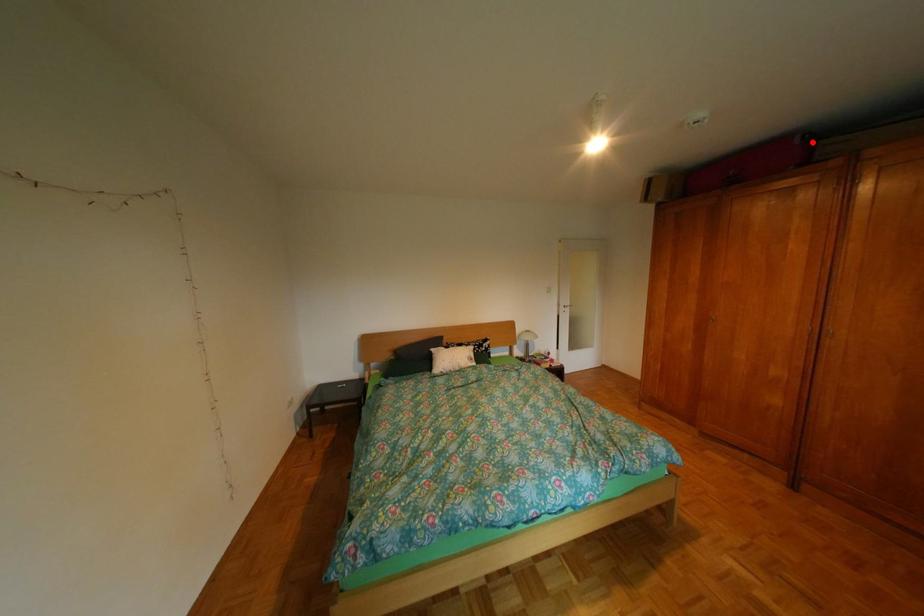
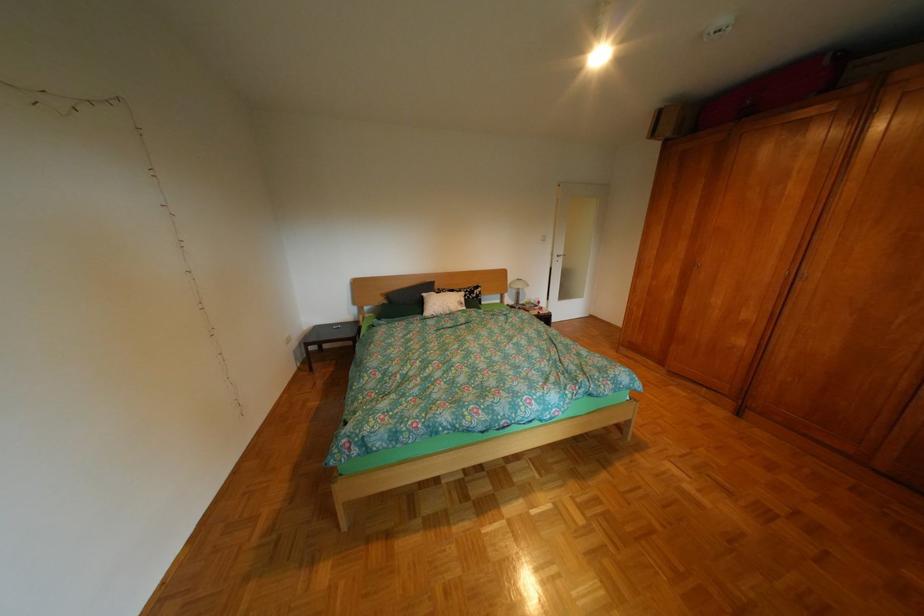
The point at the highlighted location is marked in the first image. Where is the corresponding point in the second image?

(842, 63)